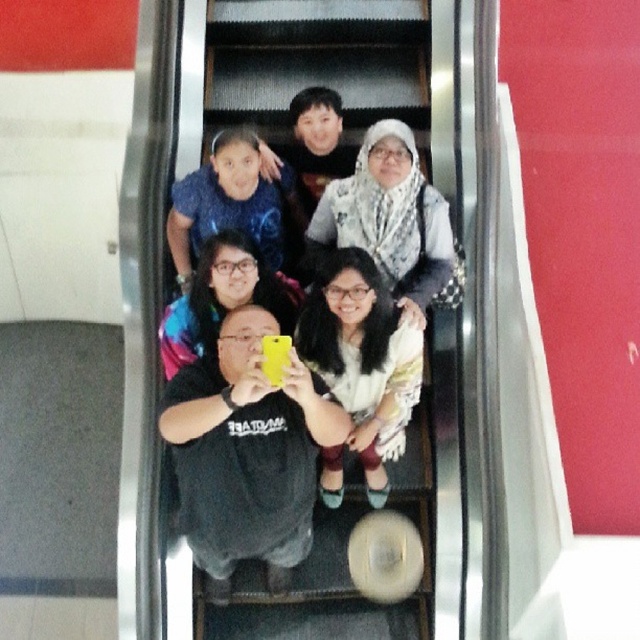
Based on the photo, which is more to the right, black matte shirt at center or white lace dress at center?

Positioned to the right is white lace dress at center.

Looking at this image, is black matte shirt at center above white lace dress at center?

Actually, black matte shirt at center is below white lace dress at center.

Does point (250, 445) come closer to viewer compared to point (348, 250)?

Yes, it is in front of point (348, 250).

Identify the location of black matte shirt at center. This screenshot has height=640, width=640. (248, 452).

Is white lace dress at center wider than blue fabric at upper center?

Incorrect, white lace dress at center's width does not surpass blue fabric at upper center's.

Between white lace dress at center and blue fabric at upper center, which one has more height?

white lace dress at center is taller.

Between point (312, 352) and point (225, 182), which one is positioned in front?

Point (312, 352) is in front.

The image size is (640, 640). What are the coordinates of `white lace dress at center` in the screenshot? It's located at (362, 358).

Who is lower down, black matte shirt at center or blue fabric at upper center?

black matte shirt at center is lower down.

Is point (296, 497) less distant than point (204, 202)?

Yes, it is in front of point (204, 202).

Which is in front, point (260, 400) or point (228, 193)?

Point (260, 400)

Locate an element on the screen. Image resolution: width=640 pixels, height=640 pixels. black matte shirt at center is located at coordinates (248, 452).